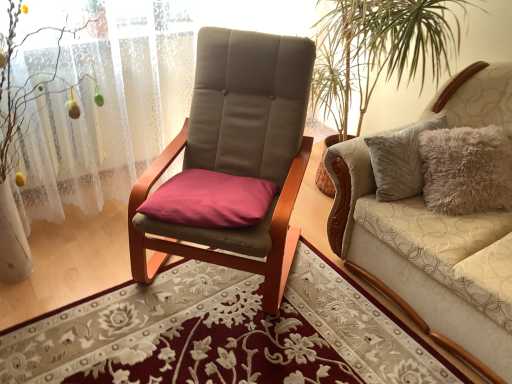
What is the approximate height of beige fabric couch at right?

beige fabric couch at right is 37.46 inches in height.

Describe the element at coordinates (426, 262) in the screenshot. I see `beige fabric couch at right` at that location.

Locate an element on the screen. beige fabric couch at right is located at coordinates (426, 262).

The image size is (512, 384). Describe the element at coordinates (110, 109) in the screenshot. I see `white lace curtain at left` at that location.

The height and width of the screenshot is (384, 512). I want to click on white lace curtain at left, so click(x=110, y=109).

Locate an element on the screen. This screenshot has width=512, height=384. beige fabric couch at right is located at coordinates (426, 262).

In the image, is white lace curtain at left on the left side or the right side of beige fabric couch at right?

white lace curtain at left is positioned on beige fabric couch at right's left side.

Is white lace curtain at left positioned before beige fabric couch at right?

No, white lace curtain at left is further to the viewer.

Which is nearer, (x=59, y=176) or (x=412, y=224)?

Point (x=59, y=176) is farther from the camera than point (x=412, y=224).

From the image's perspective, is white lace curtain at left on beige fabric couch at right?

Yes, from the image's perspective, white lace curtain at left is over beige fabric couch at right.

From a real-world perspective, is white lace curtain at left over beige fabric couch at right?

Yes, from a real-world perspective, white lace curtain at left is over beige fabric couch at right

Considering the sizes of white lace curtain at left and beige fabric couch at right in the image, is white lace curtain at left wider or thinner than beige fabric couch at right?

Clearly, white lace curtain at left has less width compared to beige fabric couch at right.

Who is shorter, white lace curtain at left or beige fabric couch at right?

beige fabric couch at right.

Is white lace curtain at left smaller than beige fabric couch at right?

Yes.

Is beige fabric couch at right a part of white lace curtain at left?

Definitely not — beige fabric couch at right is not inside white lace curtain at left.

Is white lace curtain at left not near beige fabric couch at right?

Absolutely, white lace curtain at left is distant from beige fabric couch at right.

Could you tell me if white lace curtain at left is facing beige fabric couch at right?

No, white lace curtain at left is not turned towards beige fabric couch at right.

How many degrees apart are the facing directions of white lace curtain at left and beige fabric couch at right?

The angular difference between white lace curtain at left and beige fabric couch at right is 109 degrees.

Where is `studio couch on the right side of white lace curtain at left`? The image size is (512, 384). studio couch on the right side of white lace curtain at left is located at coordinates (426, 262).

Considering the positions of objects beige fabric couch at right and white lace curtain at left in the image provided, who is more to the left, beige fabric couch at right or white lace curtain at left?

From the viewer's perspective, white lace curtain at left appears more on the left side.

Is beige fabric couch at right closer to camera compared to white lace curtain at left?

Yes, beige fabric couch at right is closer to the viewer.

Considering the positions of point (504, 263) and point (147, 142), is point (504, 263) closer or farther from the camera than point (147, 142)?

Point (504, 263).

From the image's perspective, does beige fabric couch at right appear lower than white lace curtain at left?

Indeed, from the image's perspective, beige fabric couch at right is shown beneath white lace curtain at left.

From a real-world perspective, is beige fabric couch at right physically below white lace curtain at left?

Yes.

Is beige fabric couch at right wider than white lace curtain at left?

Correct, the width of beige fabric couch at right exceeds that of white lace curtain at left.

Considering the sizes of objects beige fabric couch at right and white lace curtain at left in the image provided, who is shorter, beige fabric couch at right or white lace curtain at left?

Standing shorter between the two is beige fabric couch at right.

Which of these two, beige fabric couch at right or white lace curtain at left, is bigger?

beige fabric couch at right.

Is white lace curtain at left surrounded by beige fabric couch at right?

Actually, white lace curtain at left is outside beige fabric couch at right.

In the scene shown: Is beige fabric couch at right next to white lace curtain at left and touching it?

No, beige fabric couch at right is not next to white lace curtain at left.

Is beige fabric couch at right aimed at white lace curtain at left?

No, beige fabric couch at right is not oriented towards white lace curtain at left.

What's the angular difference between beige fabric couch at right and white lace curtain at left's facing directions?

109 degrees separate the facing orientations of beige fabric couch at right and white lace curtain at left.

You are a GUI agent. You are given a task and a screenshot of the screen. Output one action in this format:
    pyautogui.click(x=<x>, y=<y>)
    Task: Click on the studio couch that is on the right side of white lace curtain at left
    The height and width of the screenshot is (384, 512).
    Given the screenshot: What is the action you would take?
    [426, 262]

This screenshot has width=512, height=384. Find the location of `curtain above the beige fabric couch at right (from a real-world perspective)`. curtain above the beige fabric couch at right (from a real-world perspective) is located at coordinates (110, 109).

Locate an element on the screen. The image size is (512, 384). curtain above the beige fabric couch at right (from the image's perspective) is located at coordinates (110, 109).